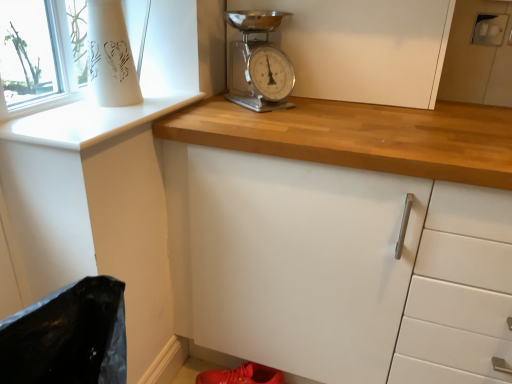
Question: From a real-world perspective, is chrome metallic scale at upper center above or below white glossy window sill at upper left?

Choices:
 (A) above
 (B) below

Answer: (A)

Question: From the image's perspective, is chrome metallic scale at upper center located above or below white glossy window sill at upper left?

Choices:
 (A) above
 (B) below

Answer: (A)

Question: Which object is positioned closest to the white glossy window sill at upper left?

Choices:
 (A) white matte cabinet at center
 (B) chrome metallic scale at upper center
 (C) shiny red shoe at lower center

Answer: (B)

Question: Which object is the closest to the chrome metallic scale at upper center?

Choices:
 (A) shiny red shoe at lower center
 (B) white matte cabinet at center
 (C) white glossy window sill at upper left

Answer: (B)